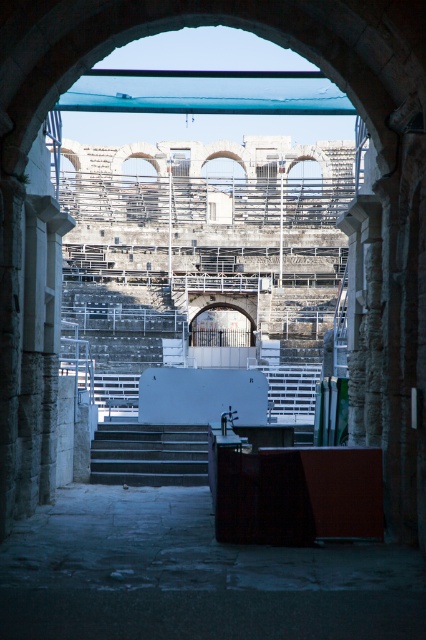
You are standing at the entrance of the amphitheater and see two points marked in the scene. One is at point coordinates point (129,435) and the other at point (310,369). Which point is closer to you?

Point (129,435) is closer to the camera than point (310,369), so the point at coordinates point (129,435) is closer to you.

You are an architect visiting the site and need to access the stage platform. You see dark gray concrete stairs at center and white plastic stairs at center. Which stairs are positioned to the left side when facing the platform?

The dark gray concrete stairs at center are to the left of the white plastic stairs at center when facing the platform.

You are an architect visiting the site and need to determine which set of stairs at the center is shorter. Which one is shorter between the dark gray concrete stairs at center and the white plastic stairs at center?

The dark gray concrete stairs at center is not as tall as the white plastic stairs at center, so the dark gray concrete stairs at center is shorter.